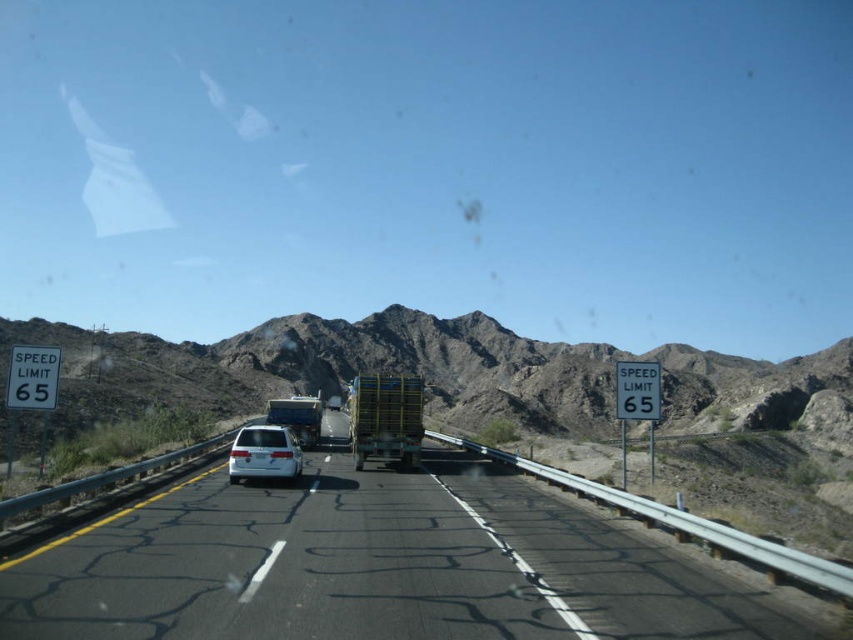
Question: Can you confirm if brown rocky mountain at center is positioned to the left of yellow mesh trailer truck at center?

Choices:
 (A) no
 (B) yes

Answer: (A)

Question: Can you confirm if yellow mesh trailer truck at center is wider than brushed metal trailer truck at center?

Choices:
 (A) no
 (B) yes

Answer: (B)

Question: Which of the following is the farthest from the observer?

Choices:
 (A) white matte sedan at center
 (B) brushed metal trailer truck at center
 (C) black asphalt highway at center
 (D) yellow mesh trailer truck at center

Answer: (B)

Question: Can you confirm if brown rocky mountain at center is positioned below yellow mesh trailer truck at center?

Choices:
 (A) no
 (B) yes

Answer: (A)

Question: Which point is farther from the camera taking this photo?

Choices:
 (A) (289, 433)
 (B) (263, 336)
 (C) (421, 396)

Answer: (B)

Question: Which of the following is the farthest from the observer?

Choices:
 (A) yellow mesh trailer truck at center
 (B) brushed metal trailer truck at center

Answer: (B)